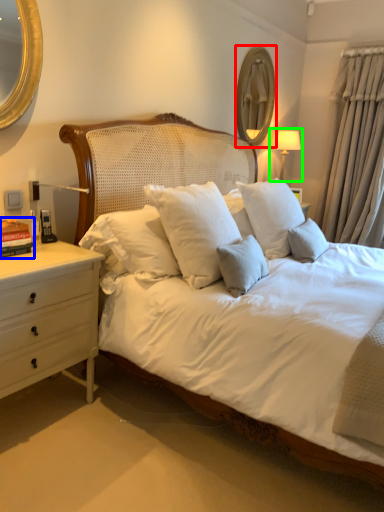
Question: Based on their relative distances, which object is nearer to mirror (highlighted by a red box)? Choose from book (highlighted by a blue box) and bedside lamp (highlighted by a green box).

Choices:
 (A) book
 (B) bedside lamp

Answer: (B)